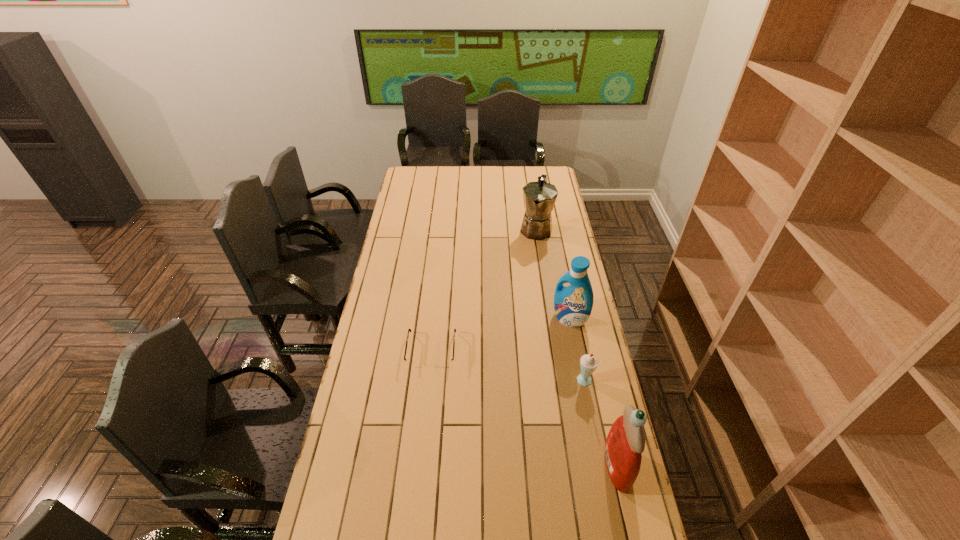
The width and height of the screenshot is (960, 540). I want to click on vacant space on the desktop that is between the shortest object and the nearer detergent and is positioned on the front-facing side of the second farthest object, so click(x=504, y=396).

This screenshot has height=540, width=960. I want to click on vacant space on the desktop that is between the third farthest object and the nearer detergent and is positioned on the straw side of the milkshake, so click(x=518, y=405).

The width and height of the screenshot is (960, 540). I want to click on vacant spot on the desktop that is between the shortest object and the nearer detergent and is positioned on the pouring side of the coffeepot, so click(493, 389).